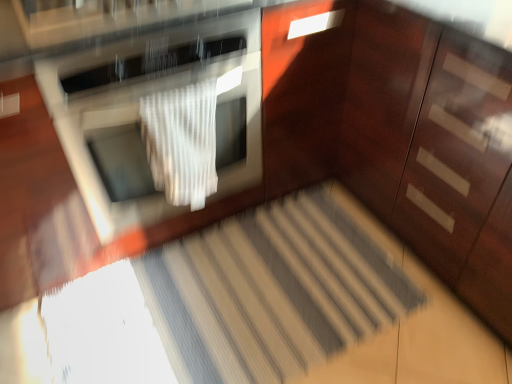
Question: Does white textured blanket at center have a smaller size compared to striped carpet at center?

Choices:
 (A) no
 (B) yes

Answer: (B)

Question: Considering the relative sizes of white textured blanket at center and striped carpet at center in the image provided, is white textured blanket at center wider than striped carpet at center?

Choices:
 (A) no
 (B) yes

Answer: (A)

Question: Is white textured blanket at center bigger than striped carpet at center?

Choices:
 (A) yes
 (B) no

Answer: (B)

Question: Is white textured blanket at center oriented towards striped carpet at center?

Choices:
 (A) no
 (B) yes

Answer: (A)

Question: Does white textured blanket at center have a greater height compared to striped carpet at center?

Choices:
 (A) no
 (B) yes

Answer: (B)

Question: From a real-world perspective, relative to satin silver oven at center, is striped carpet at center vertically above or below?

Choices:
 (A) below
 (B) above

Answer: (A)

Question: From the image's perspective, is striped carpet at center above or below satin silver oven at center?

Choices:
 (A) below
 (B) above

Answer: (A)

Question: Looking at their shapes, would you say striped carpet at center is wider or thinner than satin silver oven at center?

Choices:
 (A) wide
 (B) thin

Answer: (B)

Question: Would you say striped carpet at center is to the left or to the right of satin silver oven at center in the picture?

Choices:
 (A) left
 (B) right

Answer: (B)

Question: Is point (416, 114) closer or farther from the camera than point (184, 127)?

Choices:
 (A) closer
 (B) farther

Answer: (B)

Question: Considering the positions of glossy wood dresser at right and white textured blanket at center in the image, is glossy wood dresser at right bigger or smaller than white textured blanket at center?

Choices:
 (A) small
 (B) big

Answer: (B)

Question: From a real-world perspective, is glossy wood dresser at right above or below white textured blanket at center?

Choices:
 (A) below
 (B) above

Answer: (A)

Question: In the image, is glossy wood dresser at right positioned in front of or behind white textured blanket at center?

Choices:
 (A) behind
 (B) front

Answer: (B)

Question: Is glossy wood dresser at right inside the boundaries of satin silver oven at center, or outside?

Choices:
 (A) inside
 (B) outside

Answer: (B)

Question: In terms of width, does glossy wood dresser at right look wider or thinner when compared to satin silver oven at center?

Choices:
 (A) wide
 (B) thin

Answer: (A)